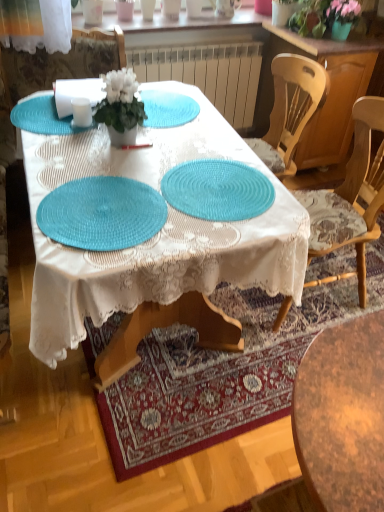
Find the location of `free point in front of wooden chair at right, the second chair positioned from the left`. free point in front of wooden chair at right, the second chair positioned from the left is located at coordinates (266, 353).